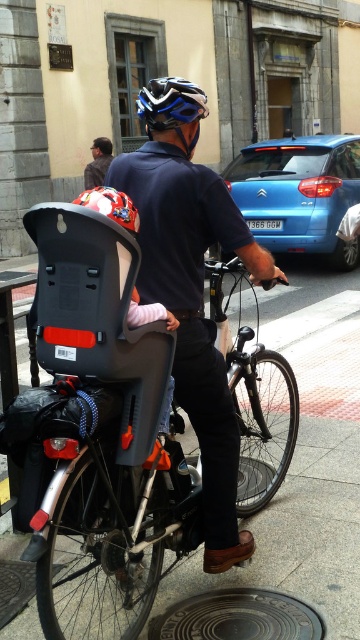
Between black matte bicycle at center and dark blue shirt at center, which one has more height?

black matte bicycle at center

Where is `black matte bicycle at center`? This screenshot has height=640, width=360. black matte bicycle at center is located at coordinates (106, 520).

Does matte black bicycle seat at center have a greater height compared to matte red helmet at upper left?

Indeed, matte black bicycle seat at center has a greater height compared to matte red helmet at upper left.

Does point (174, 268) come behind point (124, 195)?

Yes, point (174, 268) is behind point (124, 195).

This screenshot has height=640, width=360. I want to click on matte black bicycle seat at center, so click(x=194, y=307).

You are a GUI agent. You are given a task and a screenshot of the screen. Output one action in this format:
    pyautogui.click(x=<x>, y=<y>)
    Task: Click on the matte black bicycle seat at center
    The image size is (360, 640).
    Given the screenshot: What is the action you would take?
    pyautogui.click(x=194, y=307)

This screenshot has height=640, width=360. Find the location of `blue metallic car at center`. blue metallic car at center is located at coordinates (299, 193).

Can you confirm if blue metallic car at center is bigger than blue matte bicycle helmet at upper center?

Actually, blue metallic car at center might be smaller than blue matte bicycle helmet at upper center.

Is point (300, 179) closer to camera compared to point (182, 86)?

No.

Image resolution: width=360 pixels, height=640 pixels. In order to click on blue metallic car at center in this screenshot , I will do `click(299, 193)`.